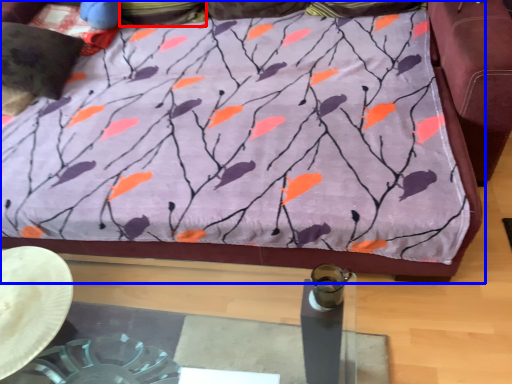
Question: Which object is further to the camera taking this photo, pillow (highlighted by a red box) or furniture (highlighted by a blue box)?

Choices:
 (A) pillow
 (B) furniture

Answer: (A)